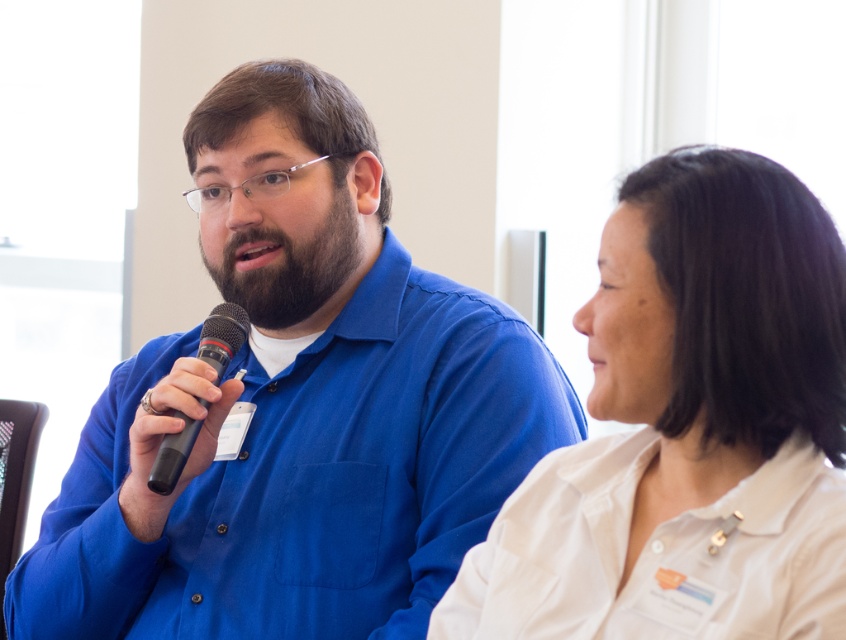
Based on the photo, you are an event organizer who needs to arrange seating for a panel discussion. The panelists are wearing the matte blue shirt at center and the white matte shirt at upper right. Based on their positions in the image, which panelist should be seated closer to the audience to maintain the current spatial relationship?

The matte blue shirt at center should be seated closer to the audience because it is already positioned closer to the viewer than the white matte shirt at upper right in the image.

Consider the image. You are standing in front of the two people in the image. You want to place a small sticker exactly at point [295,406]. Which person should you target to place the sticker on their clothing?

The point [295,406] is on the matte blue shirt at center, so you should place the sticker on the blue shirt at center belonging to the person on the left.

You are a photographer standing 10 feet away from the two people in the image. You want to capture a photo where both the matte blue shirt at center and the white matte shirt at upper right are clearly visible in the frame. Given the distance between them, will you need to adjust your camera angle to ensure both are fully in the shot?

The distance between the matte blue shirt at center and the white matte shirt at upper right is 16.61 inches. Since you are 10 feet away, this distance is likely within the camera frame without needing adjustment, as 16.61 inches at that distance would fit comfortably in most standard camera angles.